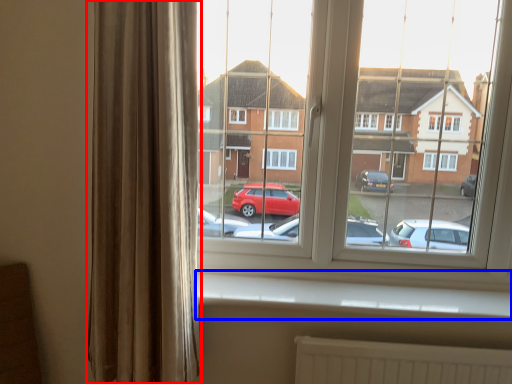
Question: Which point is closer to the camera, curtain (highlighted by a red box) or window sill (highlighted by a blue box)?

Choices:
 (A) curtain
 (B) window sill

Answer: (A)